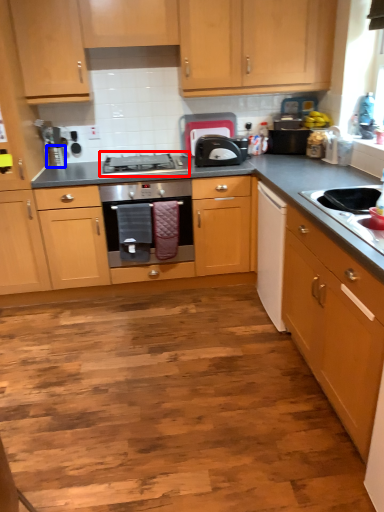
Question: Which point is closer to the camera, gas stove (highlighted by a red box) or appliance (highlighted by a blue box)?

Choices:
 (A) gas stove
 (B) appliance

Answer: (A)